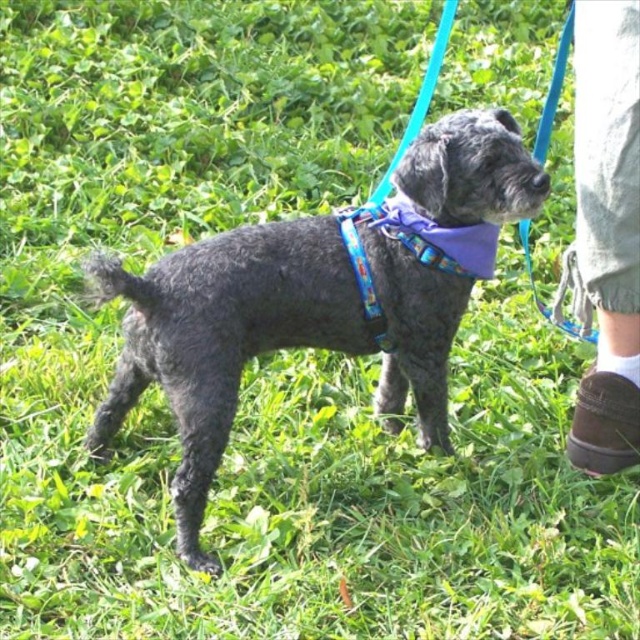
You are a dog trainer observing the scene. The shaggy gray dog at center is currently on a leash attached to the brown suede shoe at lower right. If the leash is 24 inches long, can the dog reach the shoe?

The shaggy gray dog at center is 24.48 inches from the brown suede shoe at lower right. Since the leash is only 24 inches long, the dog cannot reach the shoe as it is slightly out of reach.

You are a photographer trying to capture the perfect shot of the shaggy gray dog at center. The dog is currently positioned at coordinates approximately 0.466 on the x and 0.502 on the y. If you want to frame the dog in the center of your shot, would its current position be suitable?

The shaggy gray dog at center is already positioned at coordinates approximately 0.466 on the x and 0.502 on the y, which places it near the center of the image. Therefore, its current position is suitable for framing the dog in the center of your shot.

You are a dog trainer assessing the safety of the purple fabric neckband at center on the shaggy gray dog at center. Based on their sizes, can you determine if the neckband is appropriately sized for the dog?

The shaggy gray dog at center is larger in size than the purple fabric neckband at center, so the neckband may be too small to fit the dog properly.